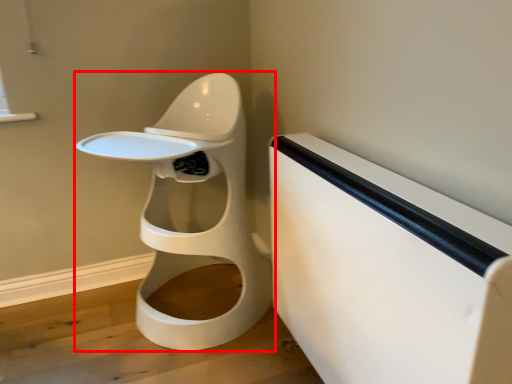
Question: From the image's perspective, what is the correct spatial relationship of toilet (annotated by the red box) in relation to changing table?

Choices:
 (A) above
 (B) below

Answer: (A)